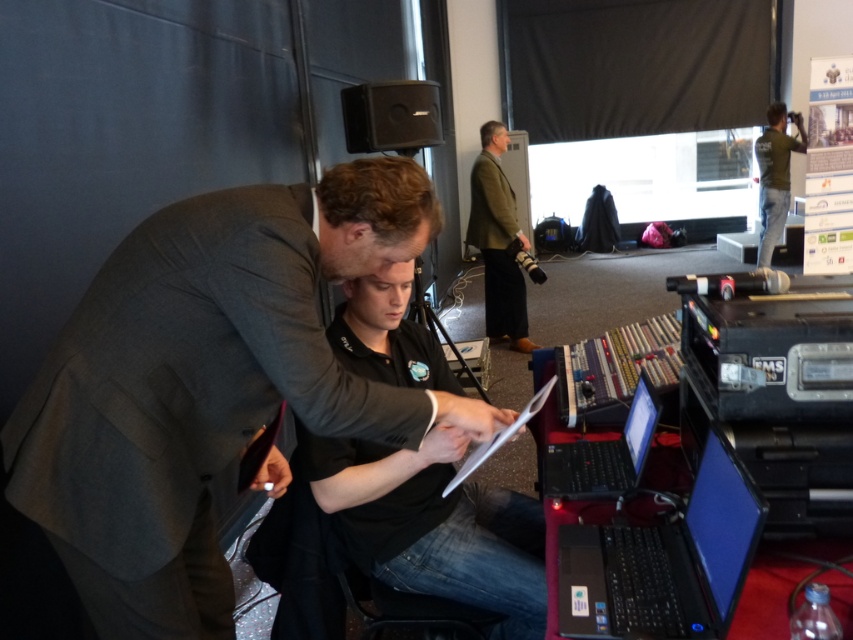
Who is shorter, dark gray suit at center or green cotton shirt at upper right?

With less height is dark gray suit at center.

Can you confirm if dark gray suit at center is bigger than green cotton shirt at upper right?

Incorrect, dark gray suit at center is not larger than green cotton shirt at upper right.

Identify the location of dark gray suit at center. (207, 384).

Is black matte shirt at center below green woolen blazer at center?

Yes.

Between point (374, 499) and point (480, 221), which one is positioned behind?

The point (480, 221) is behind.

Is point (395, 316) more distant than point (498, 170)?

No, it is in front of (498, 170).

At what (x,y) coordinates should I click in order to perform the action: click on black matte shirt at center. Please return your answer as a coordinate pair (x, y). The width and height of the screenshot is (853, 640). Looking at the image, I should click on (433, 525).

Which is behind, point (372, 429) or point (508, 620)?

The point (508, 620) is behind.

Does dark gray suit at center have a lesser height compared to black matte shirt at center?

No, dark gray suit at center is not shorter than black matte shirt at center.

Describe the element at coordinates (207, 384) in the screenshot. I see `dark gray suit at center` at that location.

The image size is (853, 640). What are the coordinates of `dark gray suit at center` in the screenshot? It's located at tap(207, 384).